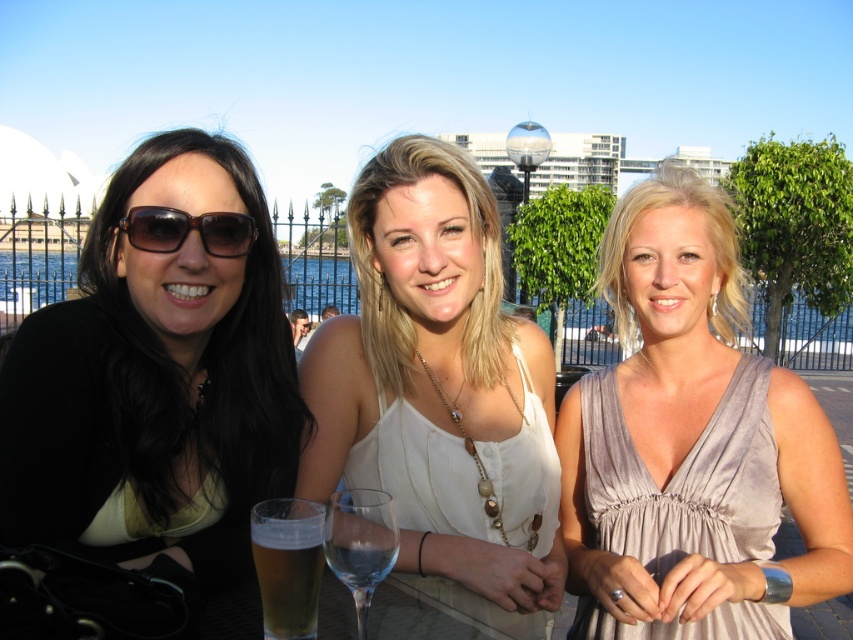
Who is more distant from viewer, [553,488] or [293,605]?

Point [553,488]

Is point (494, 285) positioned behind point (259, 566)?

Yes, point (494, 285) is behind point (259, 566).

The image size is (853, 640). I want to click on white satin blouse at center, so click(x=440, y=394).

Which is behind, point (252, 221) or point (277, 577)?

The point (252, 221) is behind.

Is point (9, 412) positioned after point (322, 522)?

Yes, it is.

Locate an element on the screen. This screenshot has height=640, width=853. matte black sunglasses at left is located at coordinates (158, 376).

Between transparent glass wine glass at center and brown shiny sunglasses at left, which one is positioned higher?

brown shiny sunglasses at left

Can you confirm if transparent glass wine glass at center is smaller than brown shiny sunglasses at left?

Indeed, transparent glass wine glass at center has a smaller size compared to brown shiny sunglasses at left.

At what (x,y) coordinates should I click in order to perform the action: click on transparent glass wine glass at center. Please return your answer as a coordinate pair (x, y). Looking at the image, I should click on (360, 544).

I want to click on transparent glass wine glass at center, so click(360, 544).